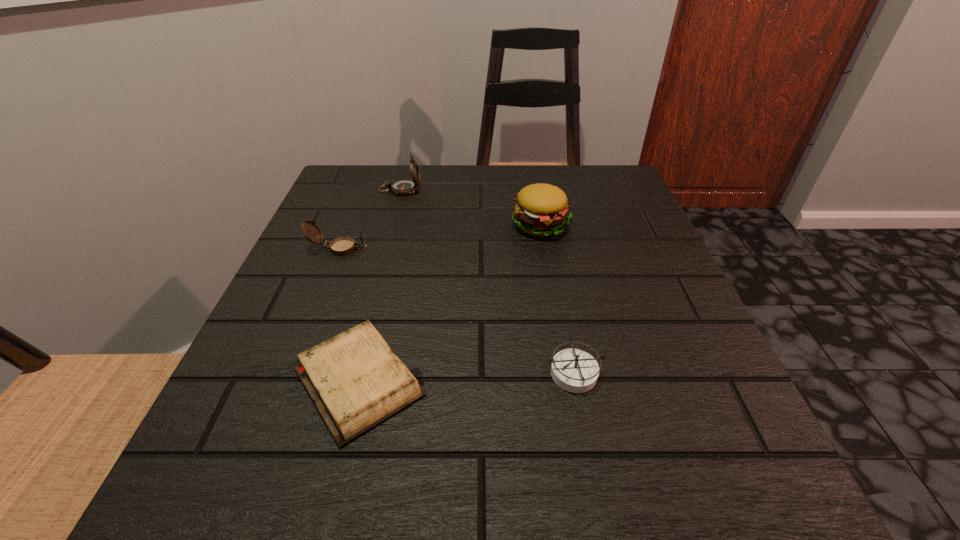
Identify which object is located as the second nearest to the hamburger. Please provide its 2D coordinates. Your answer should be formatted as a tuple, i.e. [(x, y)], where the tuple contains the x and y coordinates of a point satisfying the conditions above.

[(356, 381)]

The image size is (960, 540). I want to click on compass that is the closest to the third shortest object, so click(x=403, y=186).

Locate which compass is the closest to the shortest object. Please provide its 2D coordinates. Your answer should be formatted as a tuple, i.e. [(x, y)], where the tuple contains the x and y coordinates of a point satisfying the conditions above.

[(574, 370)]

At what (x,y) coordinates should I click in order to perform the action: click on blank space that satisfies the following two spatial constraints: 1. on the face of the diary; 2. on the left side of the third shortest object. Please return your answer as a coordinate pair (x, y). The width and height of the screenshot is (960, 540). Looking at the image, I should click on (286, 381).

Locate an element on the screen. The height and width of the screenshot is (540, 960). vacant space that satisfies the following two spatial constraints: 1. on the face of the diary; 2. on the right side of the second nearest compass is located at coordinates (286, 381).

Where is `free space that satisfies the following two spatial constraints: 1. on the face of the shortest compass; 2. on the left side of the farthest compass`? free space that satisfies the following two spatial constraints: 1. on the face of the shortest compass; 2. on the left side of the farthest compass is located at coordinates (350, 372).

I want to click on free space that satisfies the following two spatial constraints: 1. on the back side of the fourth tallest object; 2. on the left side of the diary, so click(x=360, y=372).

In order to click on vacant position in the image that satisfies the following two spatial constraints: 1. on the face of the farthest compass; 2. on the back side of the shortest compass in this screenshot , I will do `click(350, 372)`.

Locate an element on the screen. free location that satisfies the following two spatial constraints: 1. on the face of the third tallest object; 2. on the left side of the diary is located at coordinates (286, 381).

This screenshot has width=960, height=540. Identify the location of vacant area that satisfies the following two spatial constraints: 1. on the face of the farthest compass; 2. on the back side of the shortest object. (348, 381).